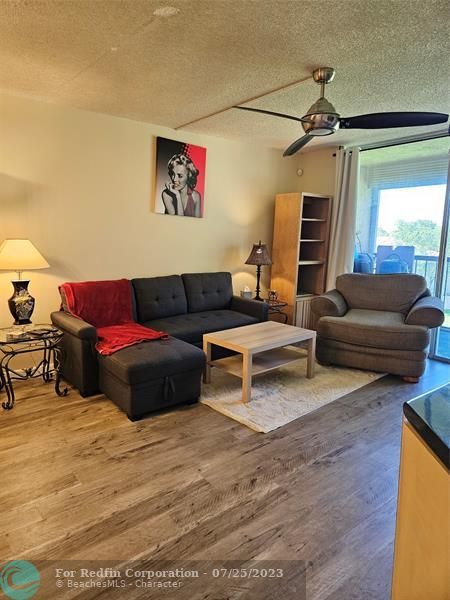
Locate an element on the screen. This screenshot has height=600, width=450. shelf is located at coordinates (292, 237).